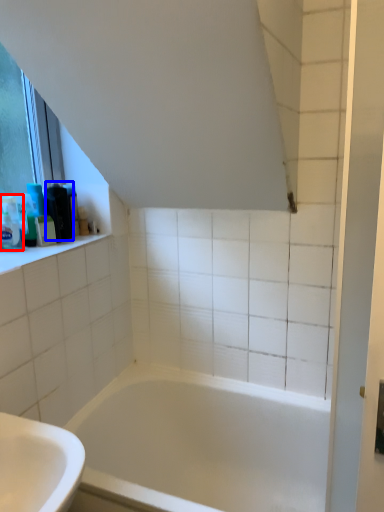
Question: Which object is further to the camera taking this photo, toiletry (highlighted by a red box) or toiletry (highlighted by a blue box)?

Choices:
 (A) toiletry
 (B) toiletry

Answer: (B)